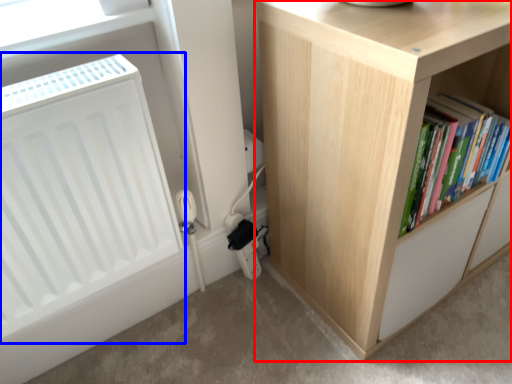
Question: Which object appears farthest to the camera in this image, cupboard (highlighted by a red box) or radiator (highlighted by a blue box)?

Choices:
 (A) cupboard
 (B) radiator

Answer: (A)